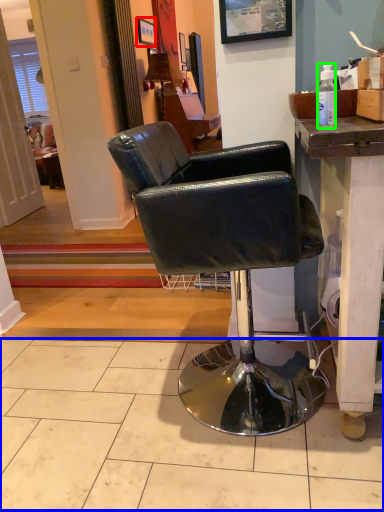
Question: Which is farther away from picture frame (highlighted by a red box)? tile (highlighted by a blue box) or bottle (highlighted by a green box)?

Choices:
 (A) tile
 (B) bottle

Answer: (A)